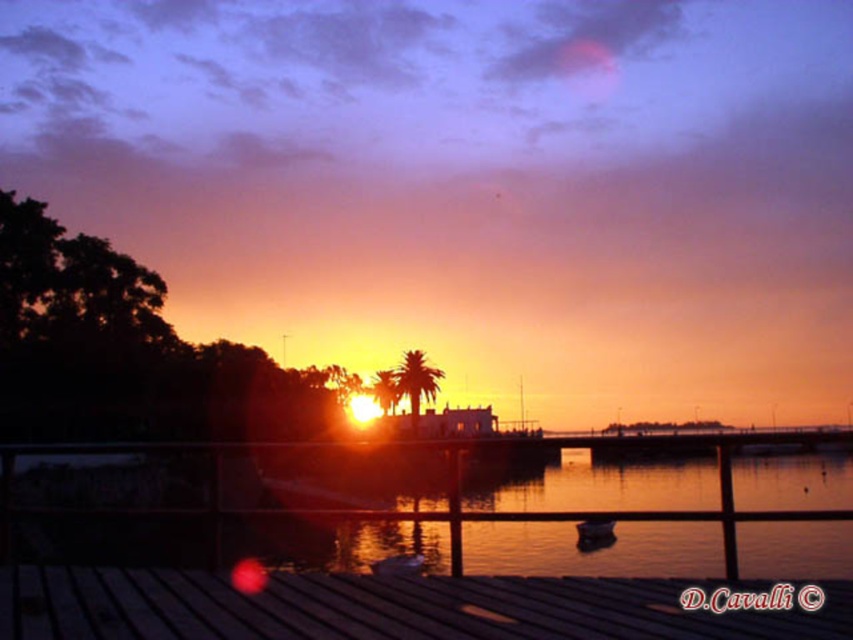
Is point (514, 580) closer to viewer compared to point (602, 532)?

Yes, it is.

Does point (645, 614) come behind point (596, 538)?

No, it is not.

Where is `wooden at lower center`? The width and height of the screenshot is (853, 640). wooden at lower center is located at coordinates (381, 608).